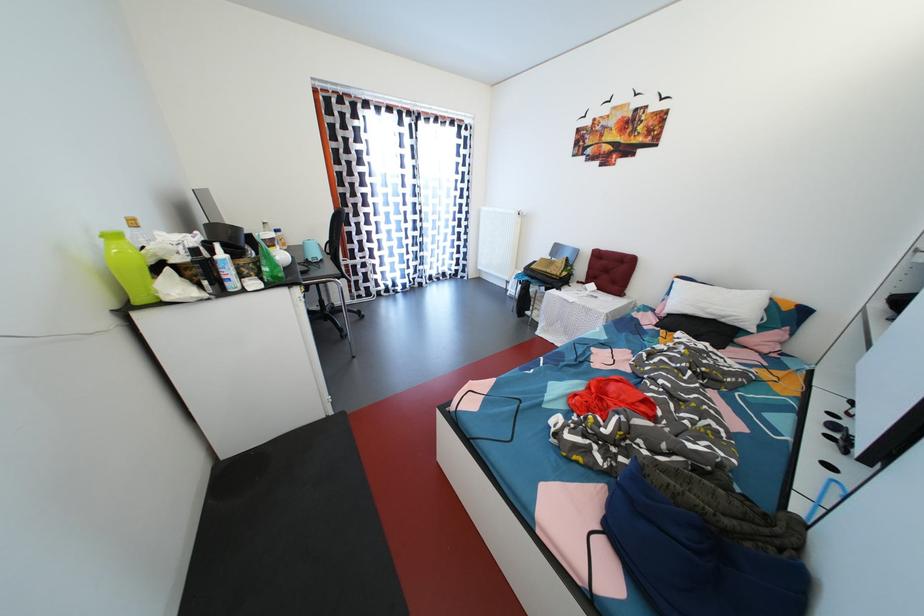
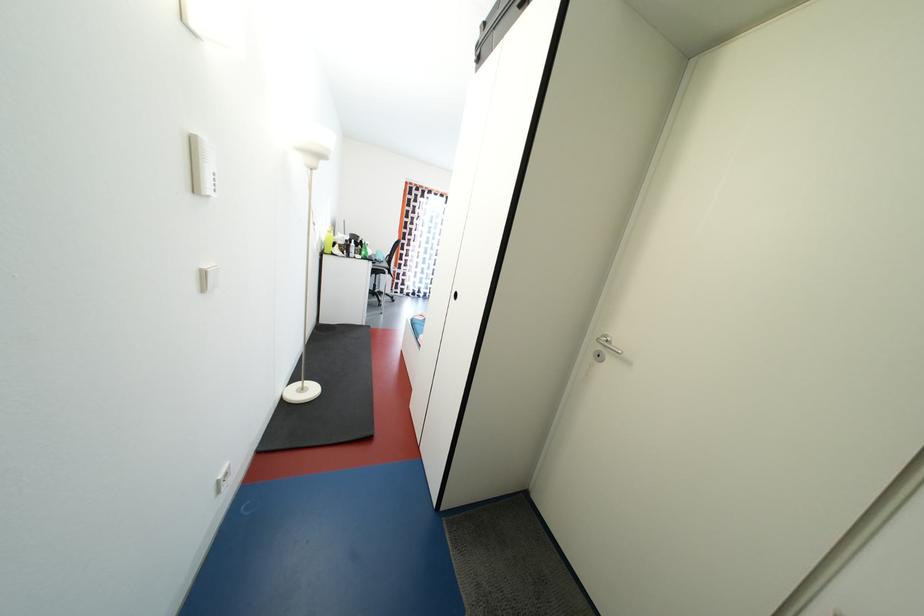
What movement of the cameraman would produce the second image?

The cameraman walked toward right, backward.